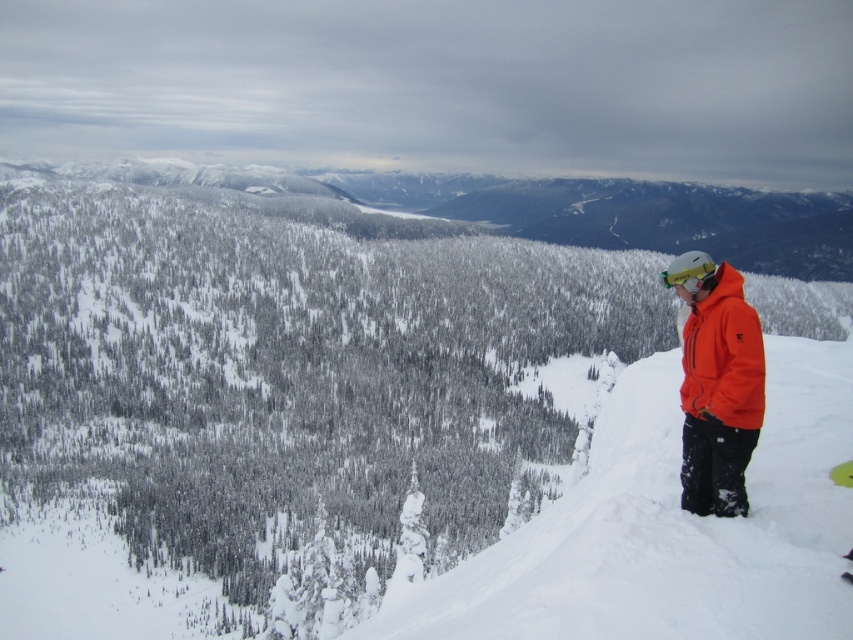
You are planning to take a photo of the white snow ski slope at right and the orange softshell jacket at right. Since you want both objects to be clearly visible in the frame, will the ski slope occupy more space than the jacket in the photo?

The white snow ski slope at right has a larger width than the orange softshell jacket at right, so yes, the ski slope will occupy more space than the jacket in the photo.

You are a photographer trying to capture the white fluffy snow at upper right and the matte yellow goggles at right in the same frame. Based on their positions, which object will appear closer to the camera in the photo?

The white fluffy snow at upper right will appear closer to the camera because it is positioned in front of the matte yellow goggles at right.